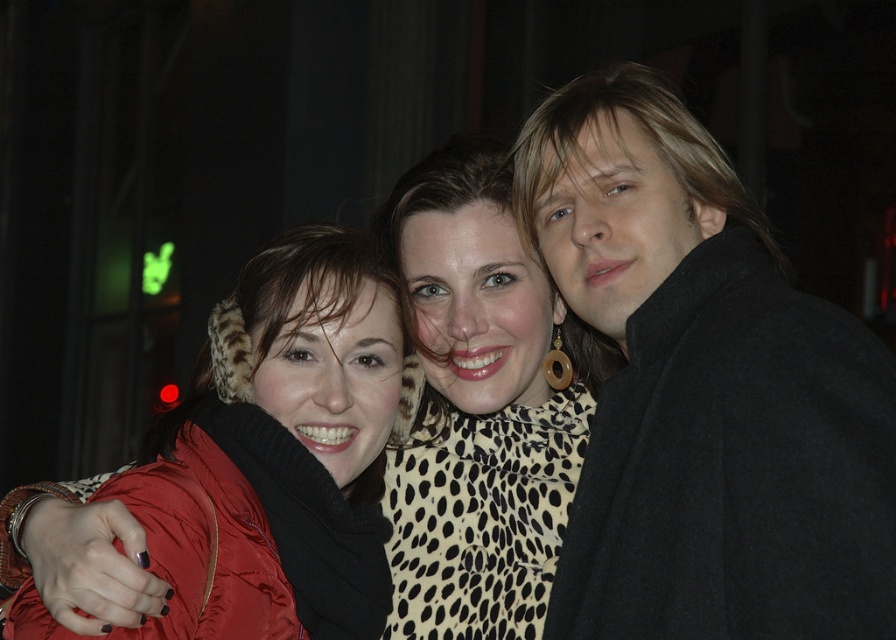
You are a photographer trying to frame a shot of the leopard print scarf at center and the matte red jacket at left. Which object is wider?

The leopard print scarf at center is less than matte red jacket at left in width, so the matte red jacket at left is wider.

In the scene shown: You are standing at the point with coordinates point [649,449] and want to move to the point with coordinates point [532,589]. Given that you can only move forward, will you be able to reach the second point without moving sideways or backward?

Point [649,449] is in front of point [532,589], so moving forward from point [649,449] will not allow you to reach point [532,589] since it is behind the first point.

You are a photographer trying to adjust the lighting for a group photo. The subjects are standing near a window with faint green and red lights. You need to ensure that the leopard print scarf at center and the matte red jacket at left are both well lit. Given their distance apart, do you think the lighting setup will require separate adjustments for each, or can you manage with a single setup?

The leopard print scarf at center is 37.12 inches from the matte red jacket at left. Since they are relatively close, a single lighting setup could likely illuminate both effectively without needing separate adjustments for each.